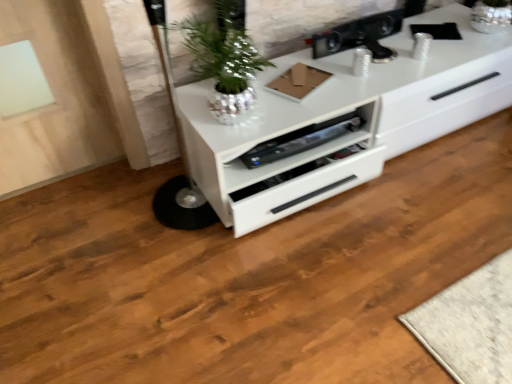
Question: Can you confirm if shiny metallic plant at center is thinner than metallic black speaker at upper center, arranged as the first appliance when viewed from the top?

Choices:
 (A) no
 (B) yes

Answer: (A)

Question: Does shiny metallic plant at center appear on the right side of metallic black speaker at upper center, the second appliance when ordered from bottom to top?

Choices:
 (A) yes
 (B) no

Answer: (B)

Question: From the image's perspective, would you say shiny metallic plant at center is shown under metallic black speaker at upper center, arranged as the first appliance when viewed from the top?

Choices:
 (A) no
 (B) yes

Answer: (B)

Question: Is the depth of shiny metallic plant at center greater than that of metallic black speaker at upper center, the second appliance when ordered from bottom to top?

Choices:
 (A) yes
 (B) no

Answer: (B)

Question: Is metallic black speaker at upper center, arranged as the first appliance when viewed from the top, inside shiny metallic plant at center?

Choices:
 (A) yes
 (B) no

Answer: (B)

Question: Is white glossy chest of drawers at center taller or shorter than metallic black speaker at upper center, the second appliance when ordered from bottom to top?

Choices:
 (A) short
 (B) tall

Answer: (B)

Question: Would you say white glossy chest of drawers at center is inside or outside metallic black speaker at upper center, the second appliance when ordered from bottom to top?

Choices:
 (A) inside
 (B) outside

Answer: (B)

Question: Looking at the image, does white glossy chest of drawers at center seem bigger or smaller compared to metallic black speaker at upper center, the second appliance when ordered from bottom to top?

Choices:
 (A) big
 (B) small

Answer: (A)

Question: Is white glossy chest of drawers at center in front of or behind metallic black speaker at upper center, arranged as the first appliance when viewed from the top, in the image?

Choices:
 (A) front
 (B) behind

Answer: (A)

Question: Considering their positions, is metallic black speaker at upper center, arranged as the first appliance when viewed from the top, located in front of or behind white glossy chest of drawers at center?

Choices:
 (A) behind
 (B) front

Answer: (A)

Question: From a real-world perspective, is metallic black speaker at upper center, arranged as the first appliance when viewed from the top, physically located above or below white glossy chest of drawers at center?

Choices:
 (A) above
 (B) below

Answer: (A)

Question: Is metallic black speaker at upper center, arranged as the first appliance when viewed from the top, taller or shorter than white glossy chest of drawers at center?

Choices:
 (A) short
 (B) tall

Answer: (A)

Question: Looking at their shapes, would you say metallic black speaker at upper center, arranged as the first appliance when viewed from the top, is wider or thinner than white glossy chest of drawers at center?

Choices:
 (A) wide
 (B) thin

Answer: (B)

Question: Would you say metallic black speaker at upper center, the second appliance when ordered from bottom to top, is to the left or to the right of satin black speaker at center, which ranks as the 2th appliance in top-to-bottom order, in the picture?

Choices:
 (A) right
 (B) left

Answer: (A)

Question: Is metallic black speaker at upper center, arranged as the first appliance when viewed from the top, taller or shorter than satin black speaker at center, which ranks as the 2th appliance in top-to-bottom order?

Choices:
 (A) tall
 (B) short

Answer: (A)